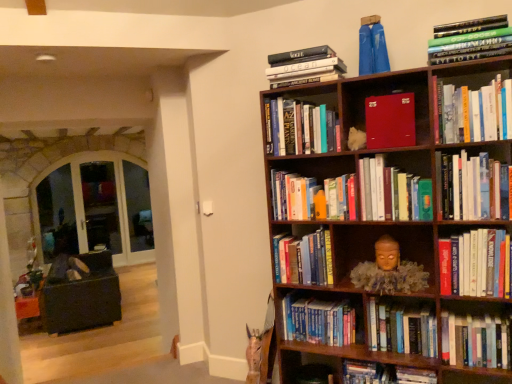
Question: Is hardcover books at upper right, placed as the second book when sorted from top to bottom, located outside hardcover book at upper right, the 4th book in the top-to-bottom sequence?

Choices:
 (A) no
 (B) yes

Answer: (B)

Question: Is hardcover books at upper right, placed as the second book when sorted from top to bottom, at the left side of hardcover book at upper right, the 4th book in the top-to-bottom sequence?

Choices:
 (A) yes
 (B) no

Answer: (A)

Question: From a real-world perspective, is hardcover books at upper right, which is the 13th book in bottom-to-top order, beneath hardcover book at upper right, which appears as the eleventh book when ordered from the bottom?

Choices:
 (A) yes
 (B) no

Answer: (B)

Question: Considering the relative sizes of hardcover books at upper right, placed as the second book when sorted from top to bottom, and hardcover book at upper right, the 4th book in the top-to-bottom sequence, in the image provided, is hardcover books at upper right, placed as the second book when sorted from top to bottom, wider than hardcover book at upper right, the 4th book in the top-to-bottom sequence,?

Choices:
 (A) yes
 (B) no

Answer: (A)

Question: From the image's perspective, is hardcover books at upper right, placed as the second book when sorted from top to bottom, beneath hardcover book at upper right, which appears as the eleventh book when ordered from the bottom?

Choices:
 (A) no
 (B) yes

Answer: (A)

Question: Based on their positions, is hardcover books at center, the 8th book from the top, located to the left or right of blue fabric pants at upper center, which ranks as the first book in top-to-bottom order?

Choices:
 (A) right
 (B) left

Answer: (A)

Question: Is hardcover books at center, the 7th book in the bottom-to-top sequence, taller or shorter than blue fabric pants at upper center, which ranks as the first book in top-to-bottom order?

Choices:
 (A) short
 (B) tall

Answer: (B)

Question: Do you think hardcover books at center, the 7th book in the bottom-to-top sequence, is within blue fabric pants at upper center, which is counted as the 14th book, starting from the bottom, or outside of it?

Choices:
 (A) outside
 (B) inside

Answer: (A)

Question: Considering the positions of hardcover books at center, the 7th book in the bottom-to-top sequence, and blue fabric pants at upper center, which is counted as the 14th book, starting from the bottom, in the image, is hardcover books at center, the 7th book in the bottom-to-top sequence, wider or thinner than blue fabric pants at upper center, which is counted as the 14th book, starting from the bottom,?

Choices:
 (A) thin
 (B) wide

Answer: (B)

Question: From a real-world perspective, relative to hardcover books at lower right, is hardcover book at upper right, which appears as the eleventh book when ordered from the bottom, vertically above or below?

Choices:
 (A) below
 (B) above

Answer: (B)

Question: Is hardcover book at upper right, the 4th book in the top-to-bottom sequence, spatially inside hardcover books at lower right, or outside of it?

Choices:
 (A) inside
 (B) outside

Answer: (B)

Question: From the image's perspective, relative to hardcover books at lower right, is hardcover book at upper right, which appears as the eleventh book when ordered from the bottom, above or below?

Choices:
 (A) below
 (B) above

Answer: (B)

Question: Is point (490, 137) positioned closer to the camera than point (317, 357)?

Choices:
 (A) farther
 (B) closer

Answer: (B)

Question: From a real-world perspective, is hardcover books at lower right above or below blue hardcover book at center, marked as the 2th book in a bottom-to-top arrangement?

Choices:
 (A) below
 (B) above

Answer: (A)

Question: Considering the positions of point (287, 370) and point (322, 334), is point (287, 370) closer or farther from the camera than point (322, 334)?

Choices:
 (A) closer
 (B) farther

Answer: (B)